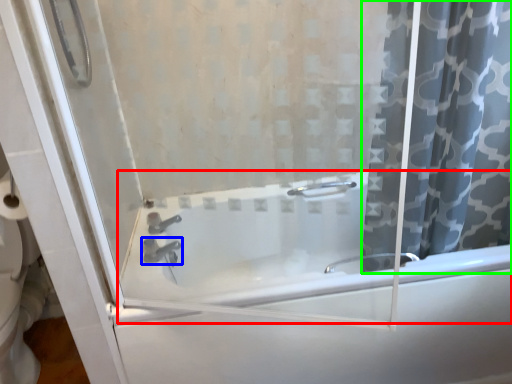
Question: Based on their relative distances, which object is nearer to bathtub (highlighted by a red box)? Choose from tap (highlighted by a blue box) and curtain (highlighted by a green box).

Choices:
 (A) tap
 (B) curtain

Answer: (B)